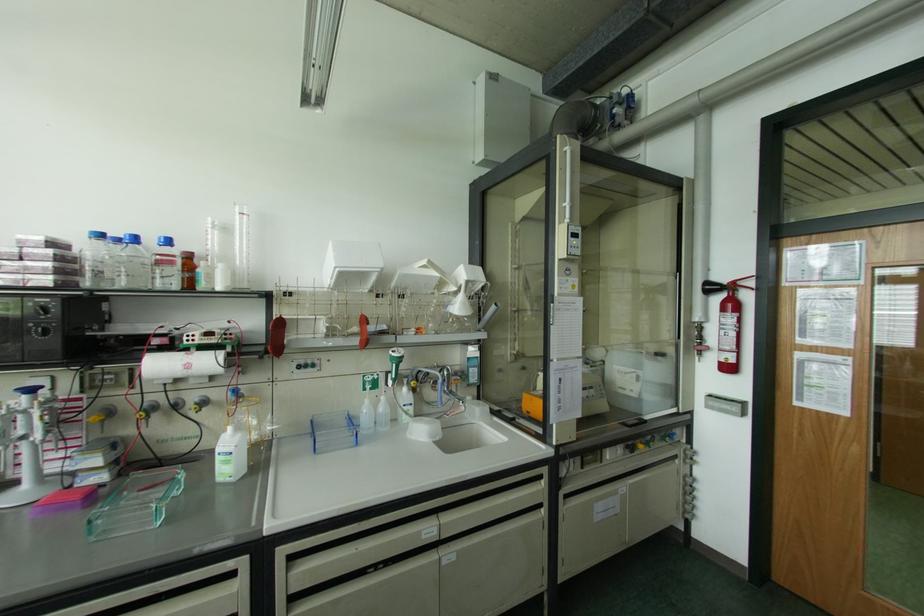
The height and width of the screenshot is (616, 924). I want to click on green sprayer handle, so click(394, 365).